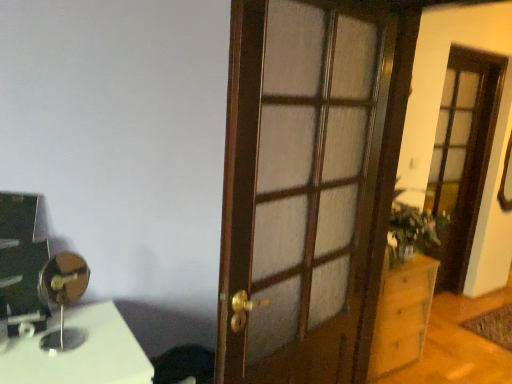
This screenshot has height=384, width=512. I want to click on vacant space to the right of wooden cabinet at right, so click(448, 361).